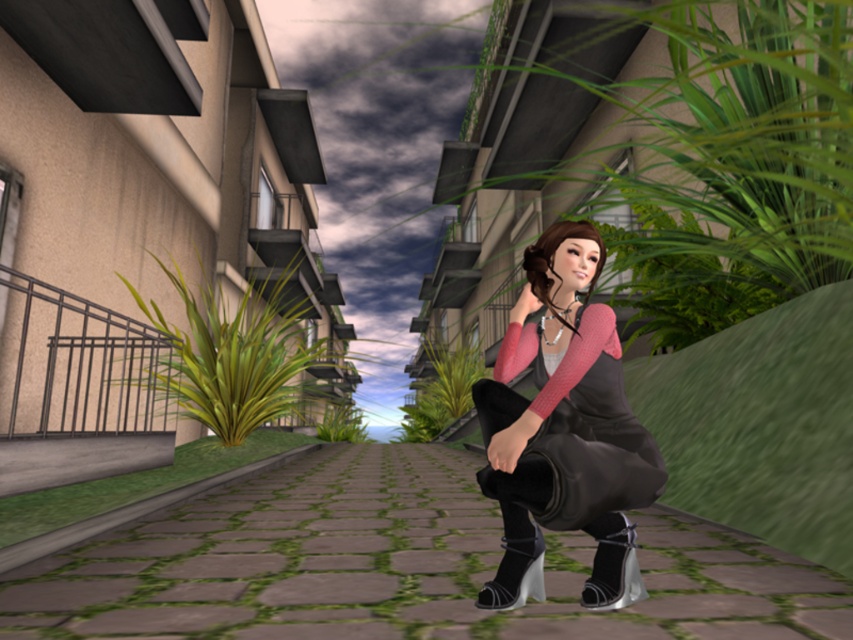
Can you confirm if matte black dress at center is bigger than black leather boot at lower center?

Indeed, matte black dress at center has a larger size compared to black leather boot at lower center.

Does matte black dress at center lie behind black leather boot at lower center?

That is False.

You are a GUI agent. You are given a task and a screenshot of the screen. Output one action in this format:
    pyautogui.click(x=<x>, y=<y>)
    Task: Click on the matte black dress at center
    
    Given the screenshot: What is the action you would take?
    pyautogui.click(x=564, y=429)

Is matte black dress at center closer to camera compared to shiny silver boot at lower center?

Yes, matte black dress at center is closer to the viewer.

Can you confirm if matte black dress at center is positioned below shiny silver boot at lower center?

No, matte black dress at center is not below shiny silver boot at lower center.

Does point (582, 451) come farther from viewer compared to point (633, 588)?

No, it is in front of (633, 588).

Identify the location of matte black dress at center. This screenshot has width=853, height=640. (564, 429).

Looking at this image, is shiny silver boot at lower center further to the viewer compared to black leather boot at lower center?

That is False.

Find the location of a particular element. Image resolution: width=853 pixels, height=640 pixels. shiny silver boot at lower center is located at coordinates (614, 570).